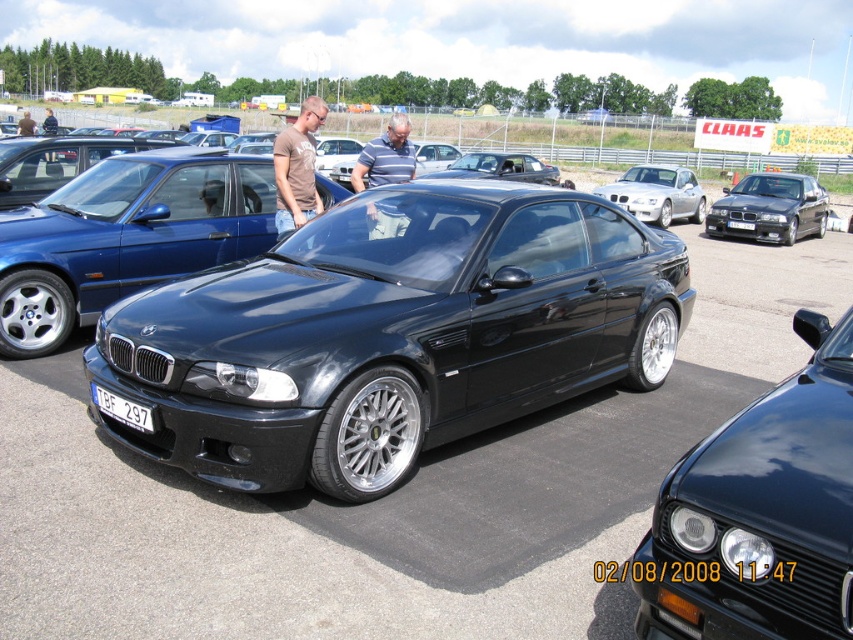
Question: Among these points, which one is nearest to the camera?

Choices:
 (A) (738, 225)
 (B) (514, 176)

Answer: (A)

Question: Can you confirm if glossy black sedan at center is wider than satin silver metallic coupe at center?

Choices:
 (A) no
 (B) yes

Answer: (A)

Question: Is the position of glossy black car at center more distant than that of black plastic license plate at center?

Choices:
 (A) yes
 (B) no

Answer: (A)

Question: Can you confirm if satin black car at center is wider than black plastic license plate at center?

Choices:
 (A) no
 (B) yes

Answer: (B)

Question: Which of the following is the closest to the observer?

Choices:
 (A) (805, 408)
 (B) (7, 246)

Answer: (A)

Question: Considering the real-world distances, which object is farthest from the glossy black sedan at center?

Choices:
 (A) satin black car at center
 (B) satin black sedan at center
 (C) satin silver metallic coupe at center

Answer: (C)